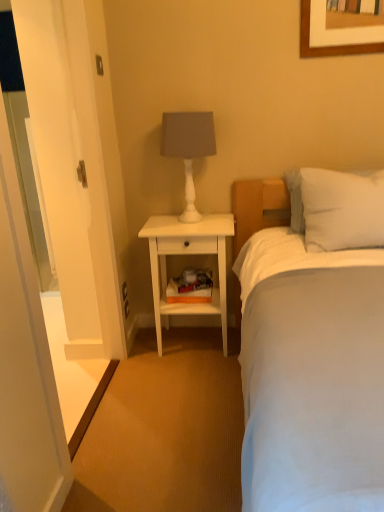
Identify the location of free space in front of white wood nightstand at center. (196, 382).